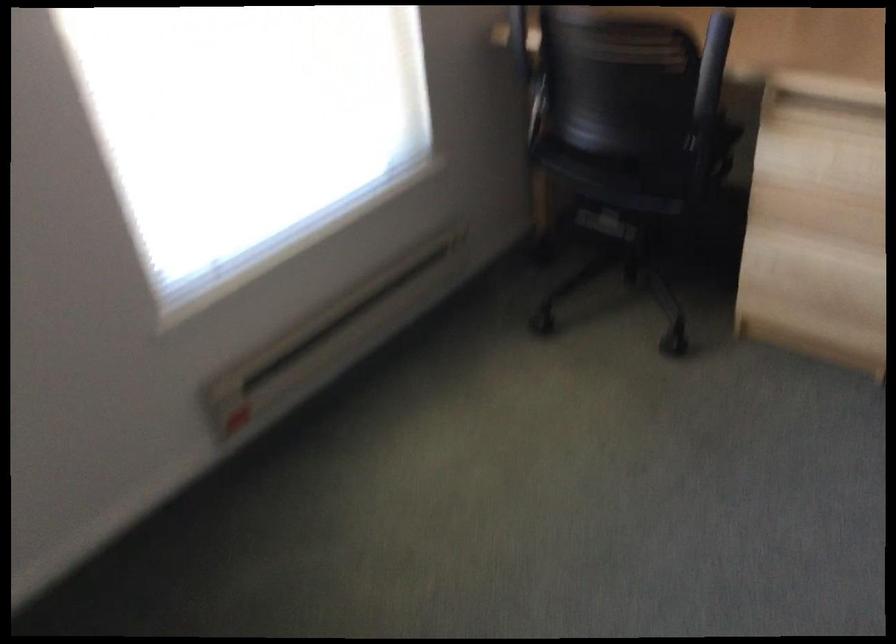
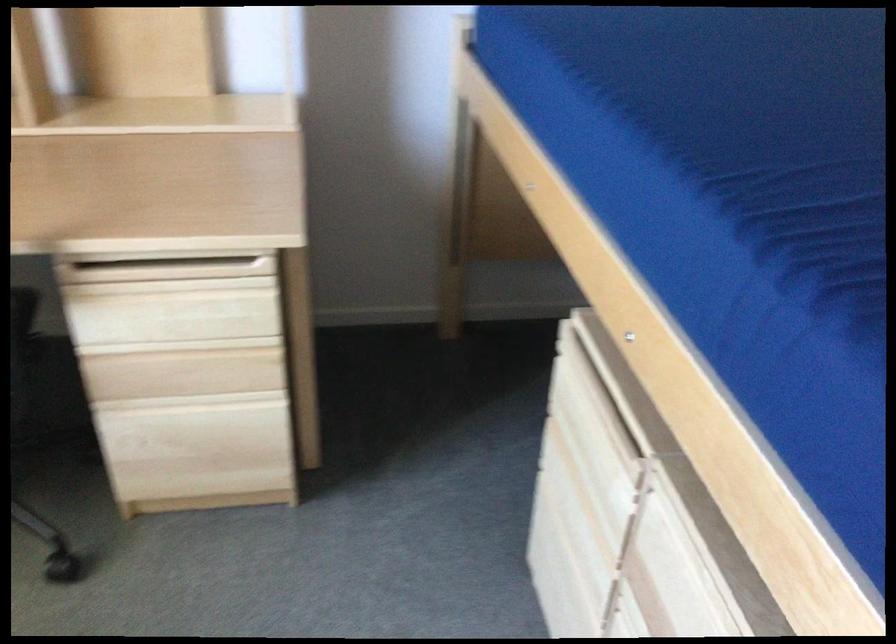
The point at (811, 301) is marked in the first image. Where is the corresponding point in the second image?

(202, 460)